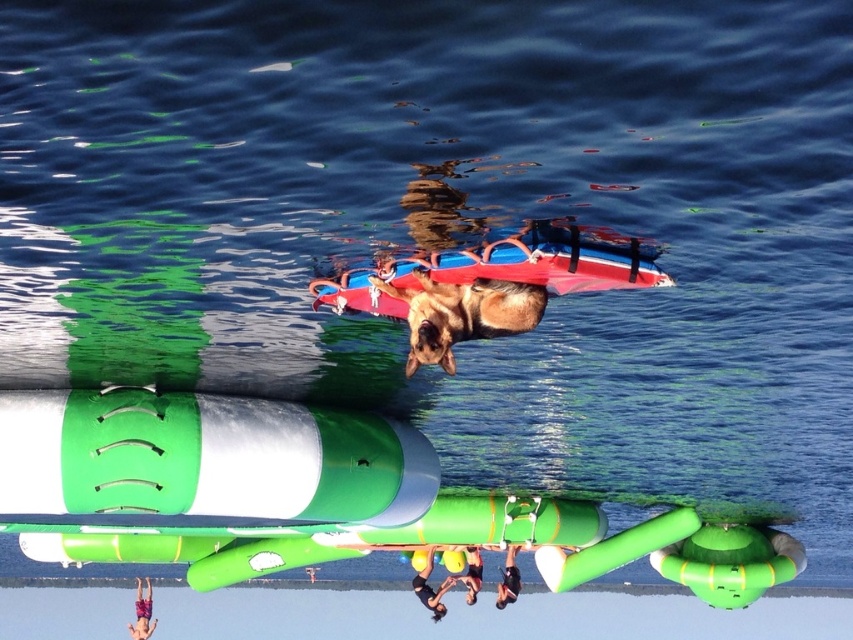
Question: Among these objects, which one is nearest to the camera?

Choices:
 (A) brown fur dog at center
 (B) dark blue skin at lower center
 (C) red matte surfboard at center

Answer: (C)

Question: Which object is positioned closest to the green matte cylinder at center?

Choices:
 (A) multicolored shorts at lower left
 (B) yellow rubber ring at lower center
 (C) dark blue skin at lower center
 (D) black matte person at lower center

Answer: (B)

Question: Can you confirm if dark blue skin at lower center is smaller than yellow rubber ring at lower center?

Choices:
 (A) no
 (B) yes

Answer: (B)

Question: Is dark blue skin at lower center thinner than yellow rubber ring at lower center?

Choices:
 (A) yes
 (B) no

Answer: (B)

Question: Among these objects, which one is farthest from the camera?

Choices:
 (A) green matte cylinder at center
 (B) yellow rubber ring at lower center
 (C) dark blue skin at lower center
 (D) brown fur dog at center

Answer: (C)

Question: Is multicolored shorts at lower left behind black matte person at lower center?

Choices:
 (A) no
 (B) yes

Answer: (B)